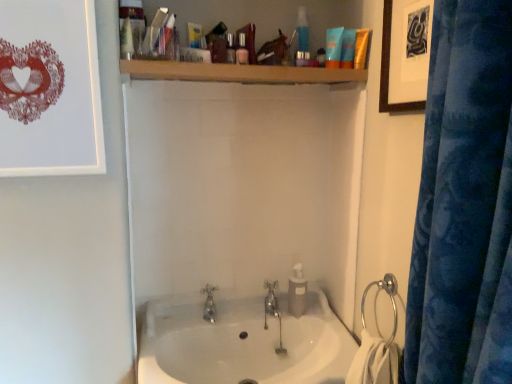
Question: From their relative heights in the image, would you say wooden framed artwork at upper right, placed as the first picture frame when sorted from right to left, is taller or shorter than white glossy sink at center?

Choices:
 (A) tall
 (B) short

Answer: (A)

Question: Choose the correct answer: Is wooden framed artwork at upper right, acting as the second picture frame starting from the left, inside white glossy sink at center or outside it?

Choices:
 (A) inside
 (B) outside

Answer: (B)

Question: Which is nearer to the wooden shelf at upper center?

Choices:
 (A) blue matte lotion at upper center, positioned as the 4th toiletry in bottom-to-top order
 (B) white plastic soap dispenser at center, the 5th toiletry positioned from the front
 (C) silver metallic tap at center, which is the 1th tap from right to left
 (D) white paper with red lace heart at upper left, which ranks as the 2th picture frame in right-to-left order
 (E) matte blue tube at upper center, the 2th toiletry when ordered from back to front

Answer: (A)

Question: Which is nearer to the translucent plastic container at upper center, which is the fourth toiletry from back to front?

Choices:
 (A) matte blue tube at upper center, which appears as the 5th toiletry when ordered from the bottom
 (B) white plastic soap dispenser at center, the 5th toiletry positioned from the front
 (C) wooden shelf at upper center
 (D) silver metallic tap at center, the second tap from the left
 (E) wooden framed artwork at upper right, acting as the second picture frame starting from the left

Answer: (C)